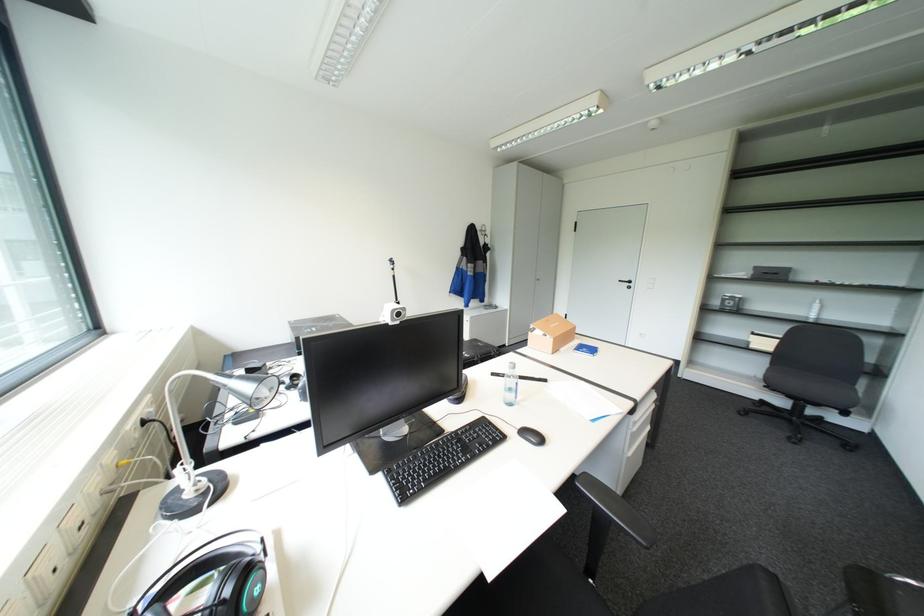
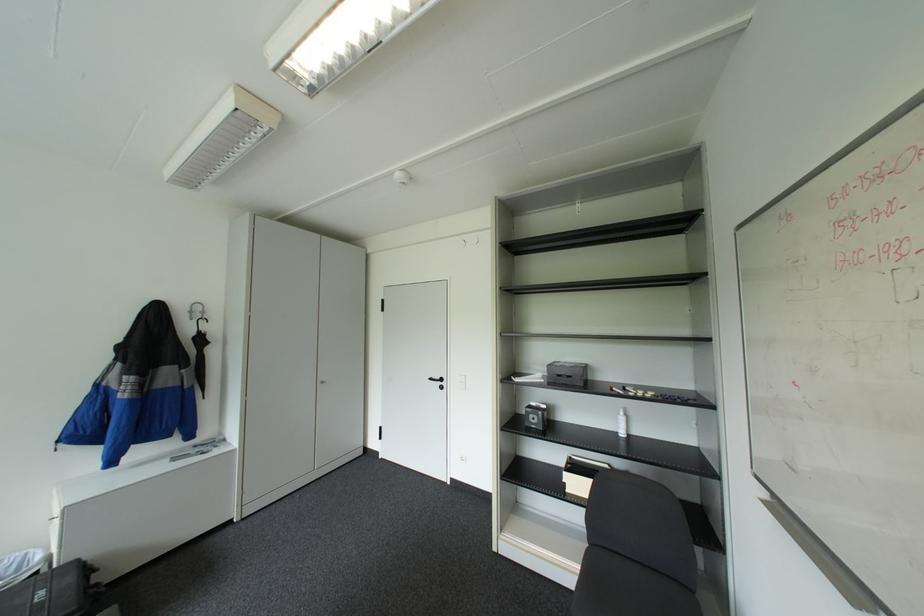
The point at (628, 280) is marked in the first image. Where is the corresponding point in the second image?

(439, 378)